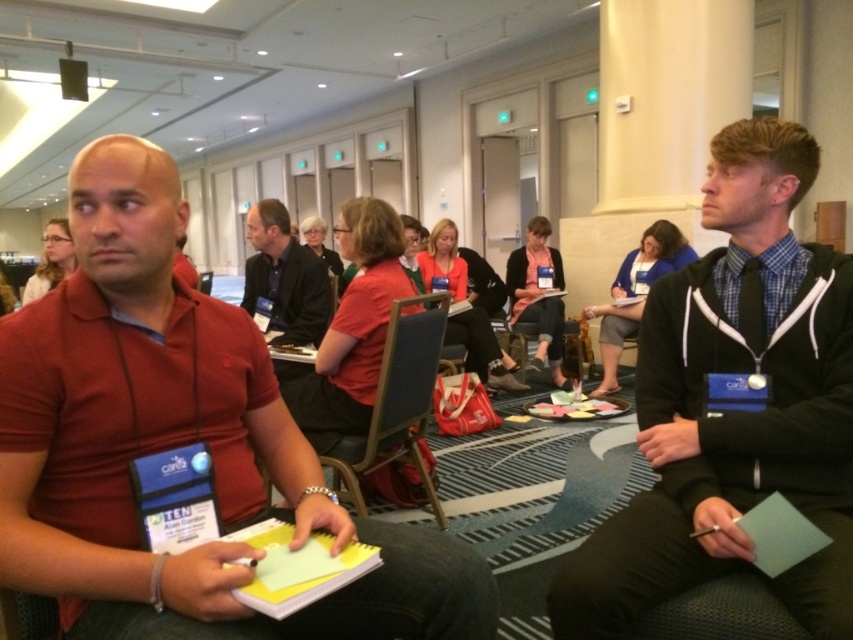
Question: Can you confirm if matte red polo shirt at left is positioned below dark gray sweater at center?

Choices:
 (A) no
 (B) yes

Answer: (B)

Question: Which object is positioned farthest from the black matte hoodie at center?

Choices:
 (A) matte red polo shirt at left
 (B) matte black chair at center

Answer: (B)

Question: Where is blue fabric jacket at center located in relation to dark gray sweater at center in the image?

Choices:
 (A) below
 (B) above

Answer: (A)

Question: Estimate the real-world distances between objects in this image. Which object is closer to the matte red polo shirt at left?

Choices:
 (A) matte black chair at center
 (B) black matte hoodie at center
 (C) matte black shirt at left
 (D) dark gray suit at center

Answer: (B)

Question: Which object is positioned farthest from the blue fabric jacket at center?

Choices:
 (A) dark gray suit at center
 (B) black matte hoodie at center
 (C) matte red polo shirt at left

Answer: (C)

Question: Does blue fabric jacket at center lie in front of matte black shirt at left?

Choices:
 (A) yes
 (B) no

Answer: (B)